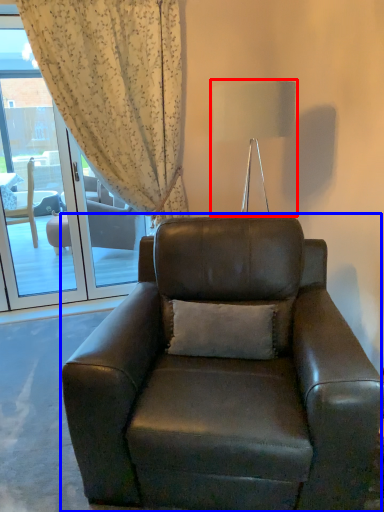
Question: Which object is closer to the camera taking this photo, lamp (highlighted by a red box) or chair (highlighted by a blue box)?

Choices:
 (A) lamp
 (B) chair

Answer: (B)